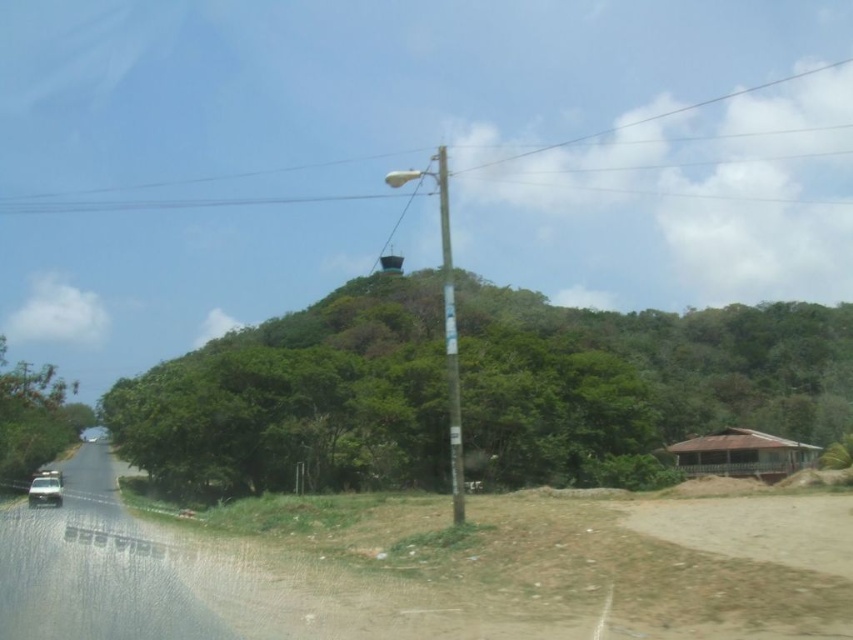
Who is more forward, [32,211] or [456,337]?

Point [456,337]

Does white plastic power line at upper center have a smaller size compared to green painted wood pole at center?

Actually, white plastic power line at upper center might be larger than green painted wood pole at center.

Does point (334, 196) come closer to viewer compared to point (450, 300)?

No, (334, 196) is behind (450, 300).

This screenshot has height=640, width=853. I want to click on white plastic power line at upper center, so click(x=157, y=204).

Does green leafy tree at center have a greater width compared to green leafy tree at left?

Indeed, green leafy tree at center has a greater width compared to green leafy tree at left.

At what (x,y) coordinates should I click in order to perform the action: click on green leafy tree at center. Please return your answer as a coordinate pair (x, y). Looking at the image, I should click on (637, 381).

Does point (283, 472) come behind point (57, 420)?

No, it is in front of (57, 420).

You are a GUI agent. You are given a task and a screenshot of the screen. Output one action in this format:
    pyautogui.click(x=<x>, y=<y>)
    Task: Click on the green leafy tree at center
    This screenshot has height=640, width=853.
    Given the screenshot: What is the action you would take?
    pyautogui.click(x=637, y=381)

Does green leafy tree at left lie behind transparent glass car window at lower left?

Yes, it is.

Who is lower down, green leafy tree at left or transparent glass car window at lower left?

green leafy tree at left is below.

Is point (25, 472) positioned in front of point (33, 484)?

No, (25, 472) is behind (33, 484).

Locate an element on the screen. Image resolution: width=853 pixels, height=640 pixels. green leafy tree at left is located at coordinates (33, 417).